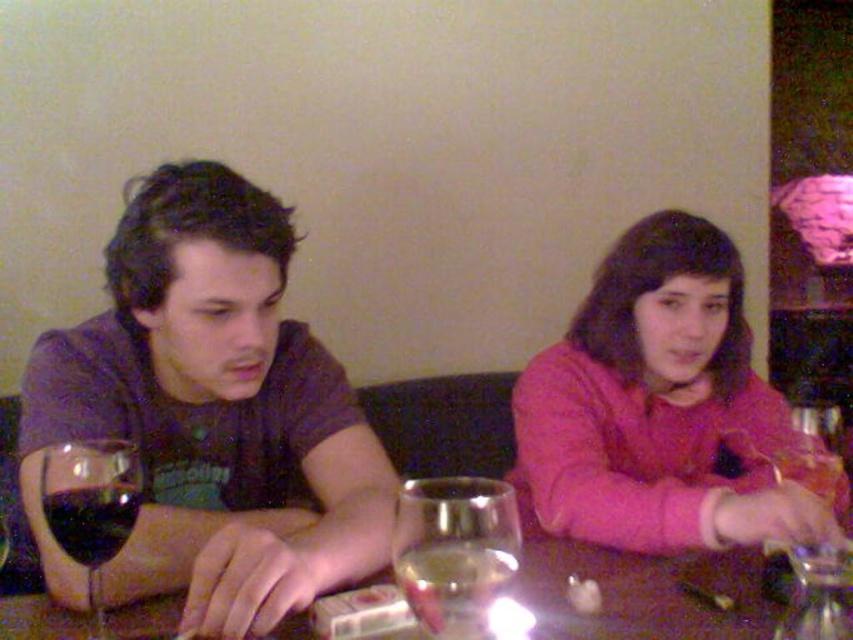
Question: Is matte black shirt at center closer to camera compared to translucent glass table at center?

Choices:
 (A) yes
 (B) no

Answer: (A)

Question: Based on their relative distances, which object is farther from the matte black shirt at center?

Choices:
 (A) dark glass at left
 (B) clear glass wine glass at center
 (C) pink fleece sweater at center
 (D) translucent glass table at center

Answer: (C)

Question: Does matte purple shirt at left appear on the left side of dark purple liquid at left?

Choices:
 (A) yes
 (B) no

Answer: (B)

Question: Is matte purple shirt at left smaller than pink fleece sweater at center?

Choices:
 (A) no
 (B) yes

Answer: (B)

Question: Which is farther from the clear glass wine glass at center?

Choices:
 (A) dark purple liquid at left
 (B) matte purple shirt at left
 (C) dark glass at left

Answer: (B)

Question: Estimate the real-world distances between objects in this image. Which object is farther from the matte black shirt at center?

Choices:
 (A) pink fleece sweater at center
 (B) translucent glass table at center
 (C) matte purple shirt at left
 (D) dark glass at left

Answer: (A)